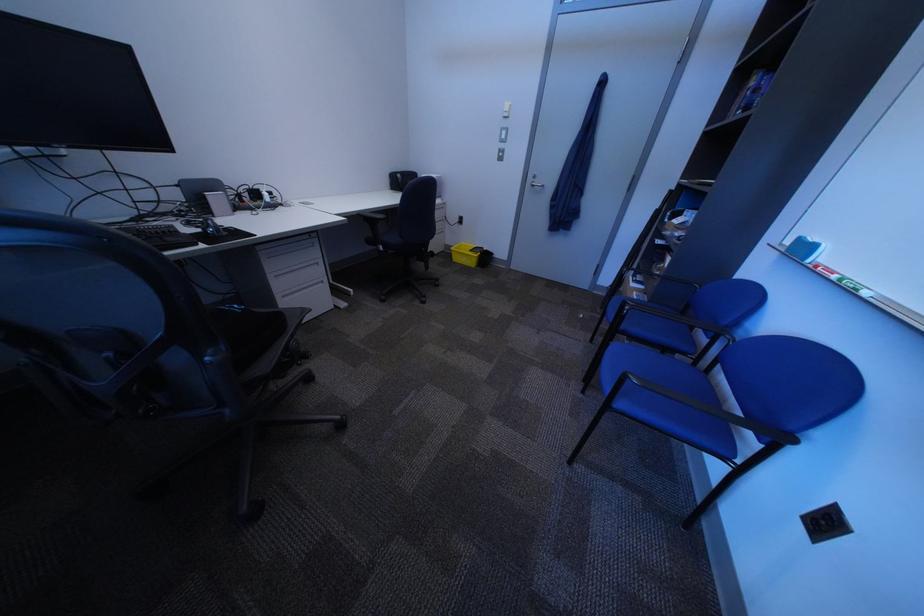
Where is `yellow plastic bin`? yellow plastic bin is located at coordinates (466, 254).